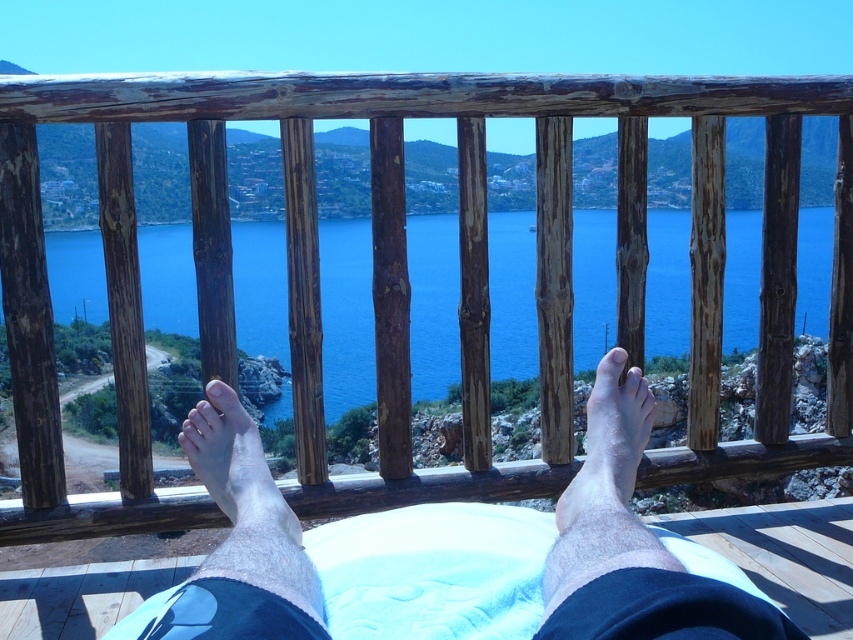
Does blue water at center have a greater height compared to white fabric at center?

Correct, blue water at center is much taller as white fabric at center.

Between point (819, 292) and point (793, 602), which one is positioned behind?

Positioned behind is point (819, 292).

Between point (573, 236) and point (33, 572), which one is positioned behind?

The point (573, 236) is behind.

Locate an element on the screen. The height and width of the screenshot is (640, 853). blue water at center is located at coordinates (346, 314).

Who is positioned more to the left, brown wooden railing at center or pale skin at lower center?

pale skin at lower center

Is brown wooden railing at center closer to the viewer compared to pale skin at lower center?

No, brown wooden railing at center is further to the viewer.

Where is `brown wooden railing at center`? brown wooden railing at center is located at coordinates (407, 275).

Between brown wooden railing at center and skinny white towel at lower center, which one appears on the left side from the viewer's perspective?

skinny white towel at lower center

Consider the image. Can you confirm if brown wooden railing at center is positioned to the left of skinny white towel at lower center?

No, brown wooden railing at center is not to the left of skinny white towel at lower center.

Between point (196, 506) and point (196, 624), which one is positioned in front?

Point (196, 624) is more forward.

I want to click on brown wooden railing at center, so click(407, 275).